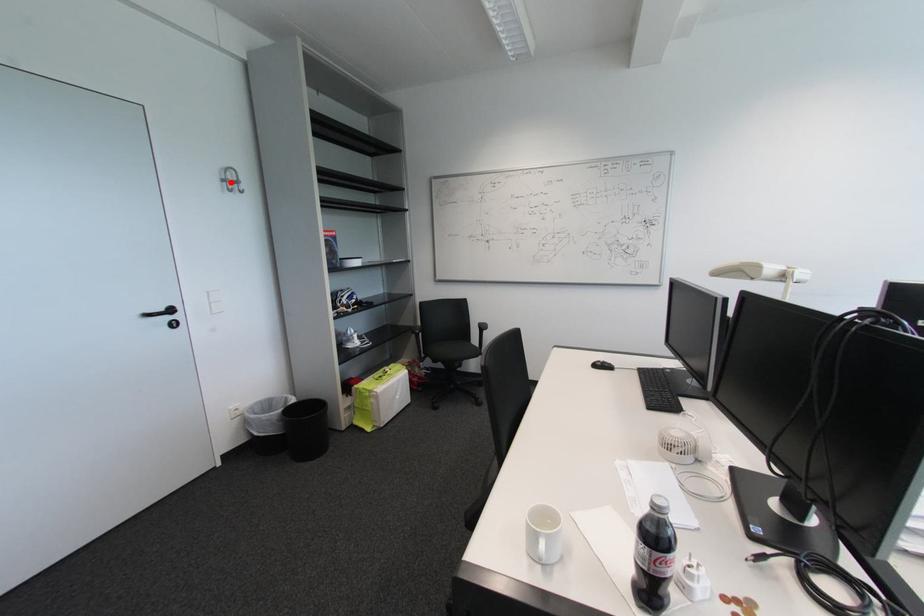
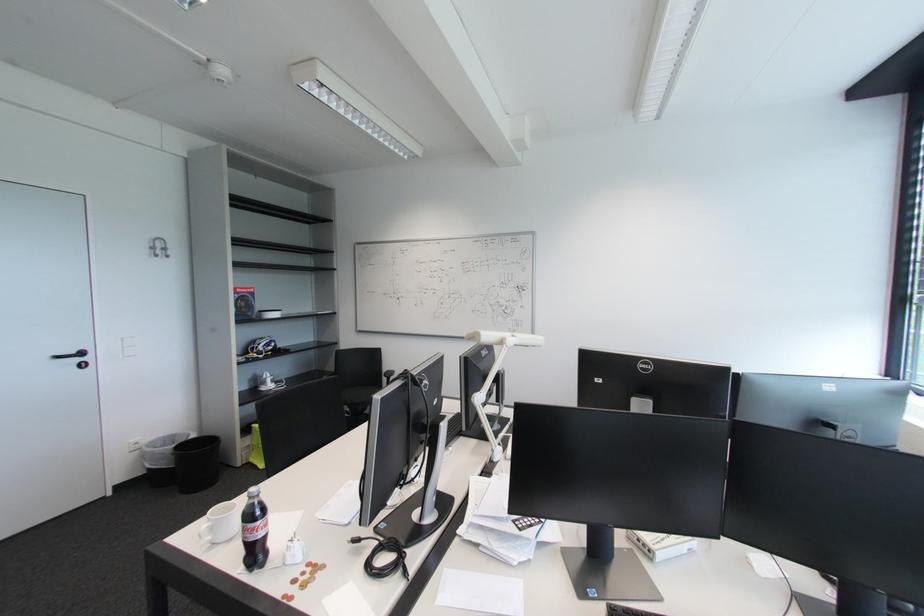
Locate, in the second image, the point that corresponds to the highlighted location in the first image.

(159, 249)